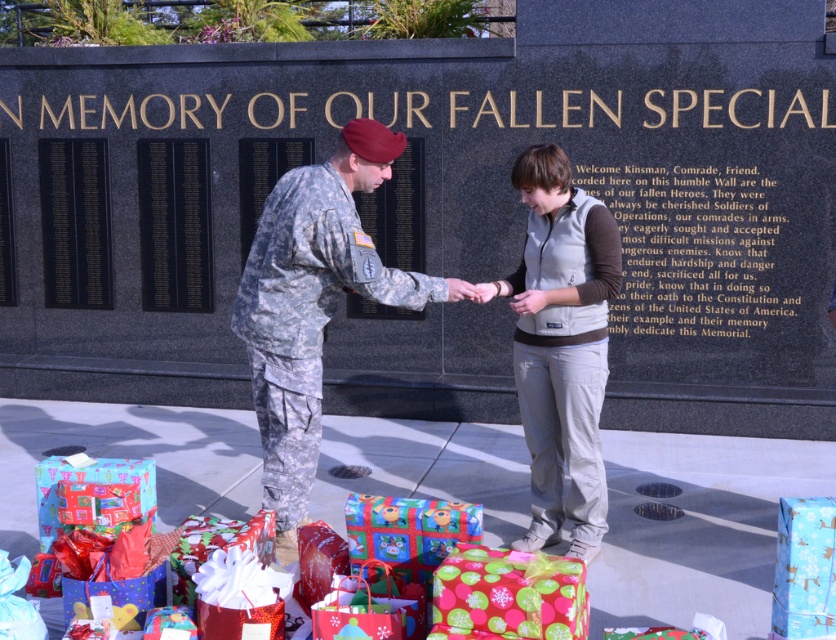
Question: Does light gray fleece vest at center have a larger size compared to blue shiny gift at lower left?

Choices:
 (A) yes
 (B) no

Answer: (A)

Question: Does blue shiny wrapping paper at lower right have a smaller size compared to blue shiny gift at lower left?

Choices:
 (A) yes
 (B) no

Answer: (A)

Question: Does camouflage fabric uniform at center appear over blue shiny gift at lower left?

Choices:
 (A) yes
 (B) no

Answer: (A)

Question: Considering the real-world distances, which object is closest to the blue shiny gift at lower left?

Choices:
 (A) light gray fleece vest at center
 (B) shiny wrapping paper gift at center

Answer: (B)

Question: Based on their relative distances, which object is farther from the camouflage fabric uniform at center?

Choices:
 (A) shiny wrapping paper gift at center
 (B) blue shiny gift at lower left

Answer: (A)

Question: Based on their relative distances, which object is nearer to the blue shiny wrapping paper at lower right?

Choices:
 (A) green polka dot paper at lower center
 (B) camouflage fabric uniform at center
 (C) blue shiny gift at lower left
 (D) shiny wrapping paper gift at center

Answer: (A)